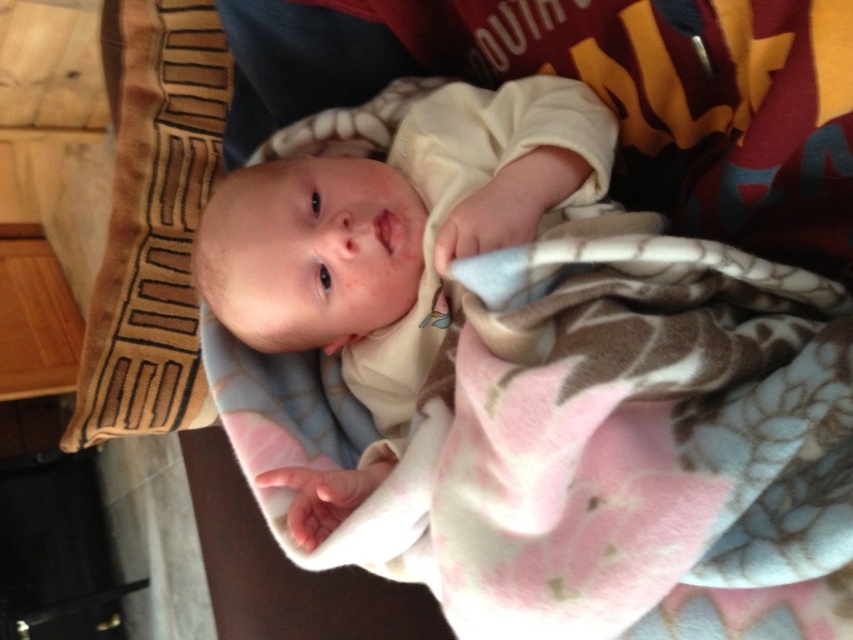
Question: Can you confirm if smooth beige baby at center is positioned above brown textured pillow at left?

Choices:
 (A) no
 (B) yes

Answer: (A)

Question: Which object is farther from the camera taking this photo?

Choices:
 (A) brown textured pillow at left
 (B) smooth beige baby at center

Answer: (A)

Question: Is smooth beige baby at center positioned at the back of brown textured pillow at left?

Choices:
 (A) no
 (B) yes

Answer: (A)

Question: Which point is farther to the camera?

Choices:
 (A) smooth beige baby at center
 (B) brown textured pillow at left

Answer: (B)

Question: Is smooth beige baby at center below brown textured pillow at left?

Choices:
 (A) yes
 (B) no

Answer: (A)